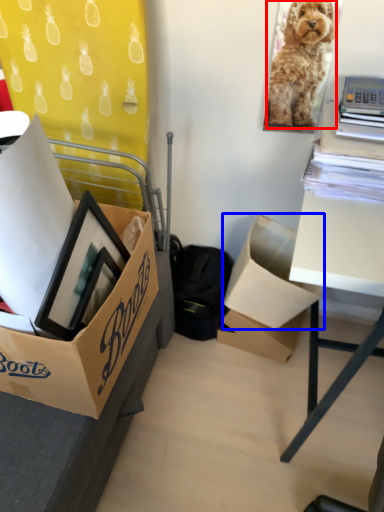
Question: Which object appears farthest to the camera in this image, dog (highlighted by a red box) or box (highlighted by a blue box)?

Choices:
 (A) dog
 (B) box

Answer: (B)